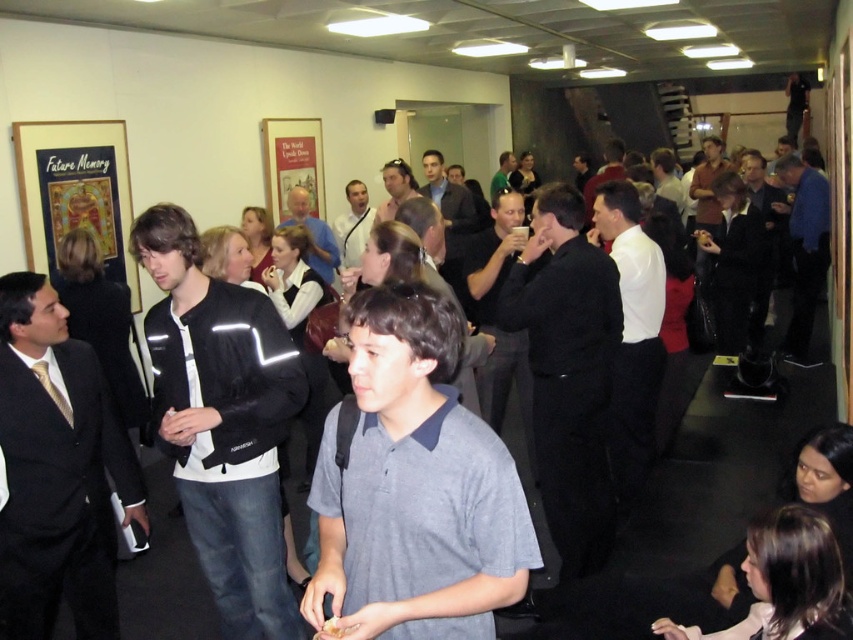
Question: Which point appears farthest from the camera in this image?

Choices:
 (A) (334, 227)
 (B) (410, 186)

Answer: (A)

Question: Does black suit at center have a larger size compared to blue shirt at center?

Choices:
 (A) yes
 (B) no

Answer: (B)

Question: Estimate the real-world distances between objects in this image. Which object is farther from the gray cotton shirt at center?

Choices:
 (A) black reflective jacket at center
 (B) blue shirt at center
 (C) black matte suit at center

Answer: (B)

Question: Which point appears farthest from the camera in this image?

Choices:
 (A) (350, 250)
 (B) (374, 214)
 (C) (648, 320)

Answer: (A)

Question: Is matte black jacket at center thinner than green fabric shirt at upper center?

Choices:
 (A) yes
 (B) no

Answer: (B)

Question: Is matte black shirt at center wider than matte black jacket at center?

Choices:
 (A) no
 (B) yes

Answer: (B)